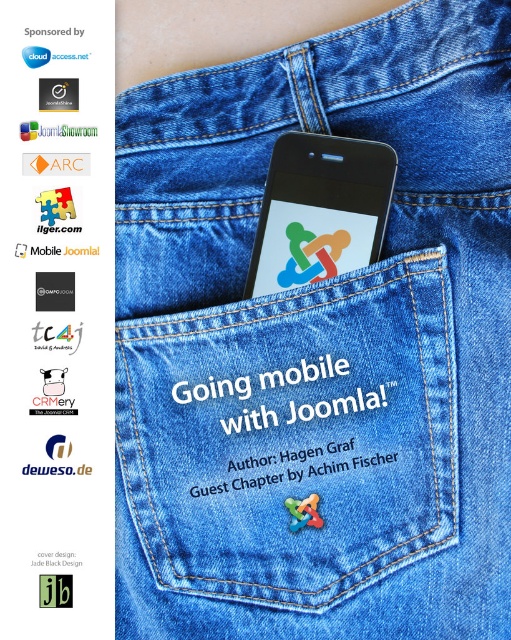
Consider the image. You are designing a promotional poster and need to ensure that all elements fit within a specific layout. The poster requires that the green matte joomla logo at center must be visible without overlapping the black glossy smartphone at center. Given their sizes, is this possible?

The black glossy smartphone at center has a greater height compared to the green matte joomla logo at center. Since the smartphone is taller, positioning the logo in a non overlapping area would require placing it either above or below the smartphone where there is enough space.

You are designing a book cover and want to ensure the green matte joomla logo at center is clearly visible. Given that the black glossy smartphone at center is covering part of it, can you determine if the logo is still visible?

The black glossy smartphone at center is in front of the green matte joomla logo at center, so the logo may be partially obscured and might not be fully visible.